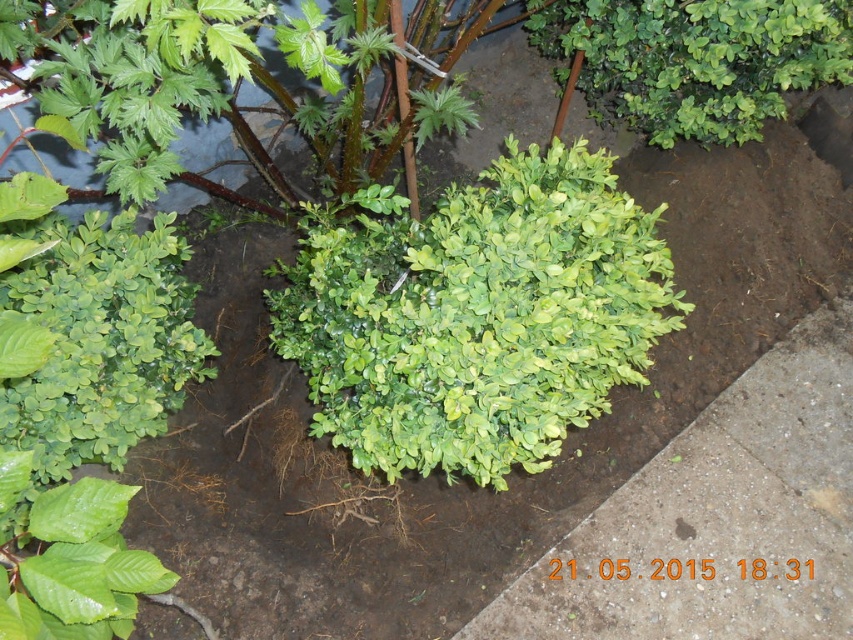
Is green leafy shrub at center shorter than green matte shrub at upper right?

No.

Between green leafy shrub at center and green matte shrub at upper right, which one has less height?

green matte shrub at upper right

The width and height of the screenshot is (853, 640). What do you see at coordinates (476, 314) in the screenshot?
I see `green leafy shrub at center` at bounding box center [476, 314].

Image resolution: width=853 pixels, height=640 pixels. What are the coordinates of `green leafy shrub at center` in the screenshot? It's located at (476, 314).